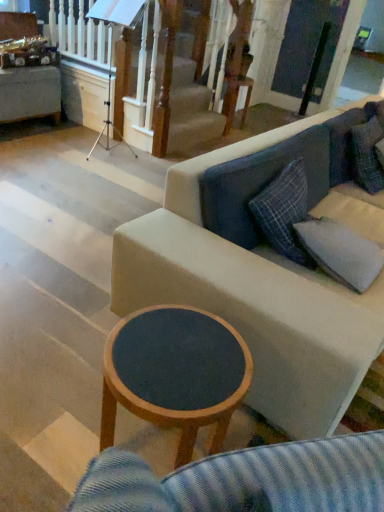
Question: Would you say fabric couch at center is a long distance from wooden round table at upper center?

Choices:
 (A) yes
 (B) no

Answer: (A)

Question: Does fabric couch at center have a larger size compared to wooden round table at upper center?

Choices:
 (A) yes
 (B) no

Answer: (A)

Question: Is the depth of fabric couch at center less than that of wooden round table at upper center?

Choices:
 (A) yes
 (B) no

Answer: (A)

Question: From a real-world perspective, does fabric couch at center stand above wooden round table at upper center?

Choices:
 (A) yes
 (B) no

Answer: (A)

Question: From the image's perspective, is fabric couch at center above wooden round table at upper center?

Choices:
 (A) yes
 (B) no

Answer: (B)

Question: Considering the relative sizes of fabric couch at center and wooden round table at upper center in the image provided, is fabric couch at center smaller than wooden round table at upper center?

Choices:
 (A) no
 (B) yes

Answer: (A)

Question: From the image's perspective, is wooden round table at center below gray fabric pillow at right?

Choices:
 (A) no
 (B) yes

Answer: (B)

Question: From a real-world perspective, is wooden round table at center located higher than gray fabric pillow at right?

Choices:
 (A) yes
 (B) no

Answer: (B)

Question: Is wooden round table at center shorter than gray fabric pillow at right?

Choices:
 (A) no
 (B) yes

Answer: (A)

Question: From a real-world perspective, is wooden round table at center under gray fabric pillow at right?

Choices:
 (A) no
 (B) yes

Answer: (B)

Question: Can you confirm if wooden round table at center is positioned to the right of gray fabric pillow at right?

Choices:
 (A) yes
 (B) no

Answer: (B)

Question: Can gray fabric pillow at right be found inside wooden round table at center?

Choices:
 (A) yes
 (B) no

Answer: (B)

Question: Is wooden round table at upper center bigger than fabric couch at center?

Choices:
 (A) yes
 (B) no

Answer: (B)